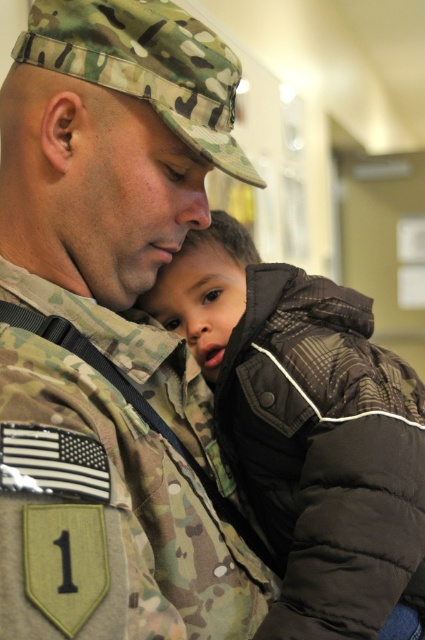
Between camo uniform at center and brown quilted jacket at center, which one appears on the left side from the viewer's perspective?

camo uniform at center is more to the left.

Who is positioned more to the right, camo uniform at center or brown quilted jacket at center?

brown quilted jacket at center

Is point (84, 634) less distant than point (362, 436)?

Yes.

Identify the location of camo uniform at center. The height and width of the screenshot is (640, 425). (116, 180).